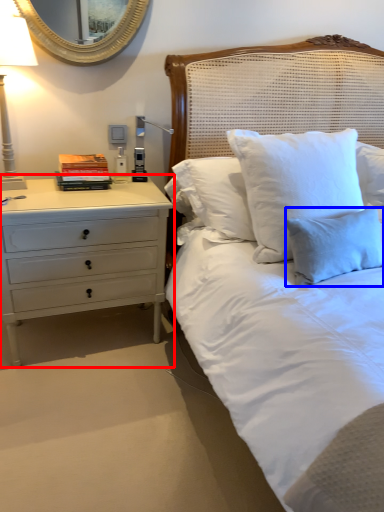
Question: Among these objects, which one is farthest to the camera, chest of drawers (highlighted by a red box) or pillow (highlighted by a blue box)?

Choices:
 (A) chest of drawers
 (B) pillow

Answer: (A)